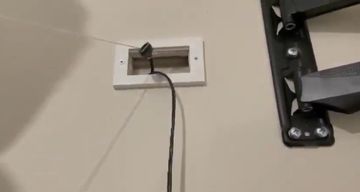
Where is `hole in wall`? The image size is (360, 192). hole in wall is located at coordinates [x=195, y=79].